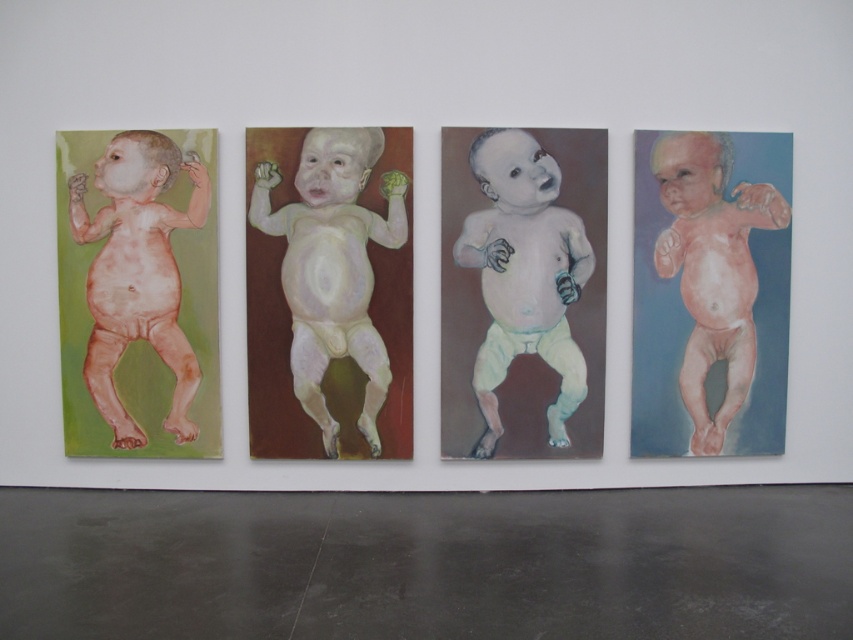
Question: Is smooth pastel baby at center bigger than matte pink baby at left?

Choices:
 (A) no
 (B) yes

Answer: (B)

Question: Can you confirm if matte pastel baby at center is thinner than matte pink baby at left?

Choices:
 (A) yes
 (B) no

Answer: (B)

Question: Which point is farther to the camera?

Choices:
 (A) (590, 227)
 (B) (73, 193)
 (C) (733, 280)

Answer: (C)

Question: Which of these objects is positioned farthest from the smooth pastel baby at center?

Choices:
 (A) matte pastel baby at center
 (B) pink pastel baby at center
 (C) matte pink baby at left

Answer: (B)

Question: Is smooth pastel baby at center wider than matte pastel baby at center?

Choices:
 (A) no
 (B) yes

Answer: (B)

Question: Considering the real-world distances, which object is closest to the smooth pastel baby at center?

Choices:
 (A) matte pastel baby at center
 (B) matte pink baby at left

Answer: (B)